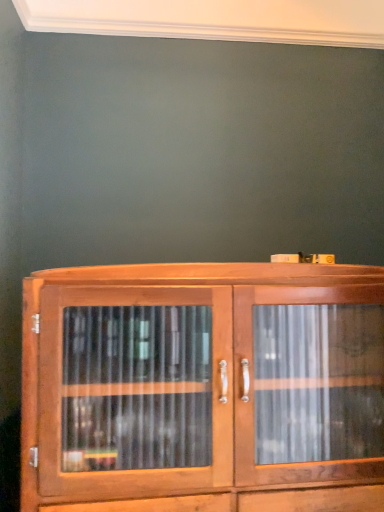
Describe the element at coordinates (203, 387) in the screenshot. Image resolution: width=384 pixels, height=512 pixels. I see `wooden cabinet at center` at that location.

Image resolution: width=384 pixels, height=512 pixels. I want to click on wooden cabinet at center, so click(x=203, y=387).

What is the approximate height of wooden cabinet at center?

wooden cabinet at center is 29.89 inches in height.

Locate an element on the screen. wooden cabinet at center is located at coordinates point(203,387).